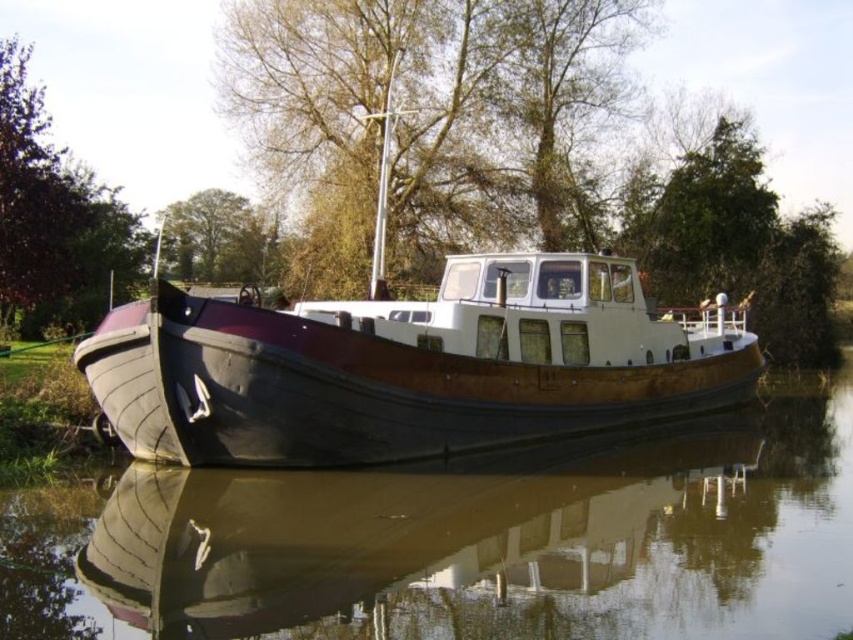
Is brown textured tree at upper center to the left of green leafy tree at upper center from the viewer's perspective?

No, brown textured tree at upper center is not to the left of green leafy tree at upper center.

Is point (589, 29) in front of point (242, 269)?

That is True.

Measure the distance between point (x=341, y=38) and camera.

They are 26.48 meters apart.

This screenshot has width=853, height=640. I want to click on brown textured tree at upper center, so (x=432, y=109).

Does point (467, 502) come behind point (225, 234)?

No, it is not.

Does brown wooden boat at center appear on the right side of green leafy tree at upper center?

Indeed, brown wooden boat at center is positioned on the right side of green leafy tree at upper center.

Describe the element at coordinates (460, 541) in the screenshot. I see `brown wooden boat at center` at that location.

This screenshot has width=853, height=640. Find the location of `brown wooden boat at center`. brown wooden boat at center is located at coordinates (460, 541).

Does point (426, 586) come behind point (577, 35)?

No, it is not.

Can you confirm if brown wooden boat at center is taller than brown textured tree at upper center?

Incorrect, brown wooden boat at center's height is not larger of brown textured tree at upper center's.

Which is in front, point (717, 589) or point (553, 116)?

Point (717, 589) is more forward.

Locate an element on the screen. brown wooden boat at center is located at coordinates (460, 541).